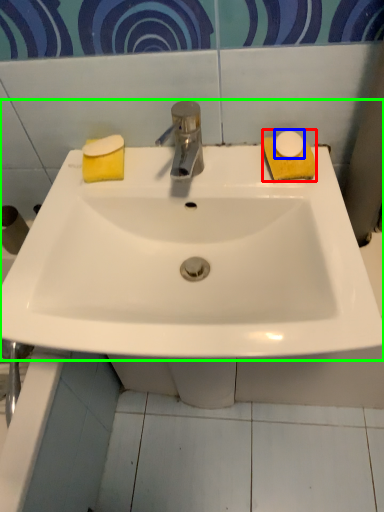
Question: Estimate the real-world distances between objects in this image. Which object is closer to soap (highlighted by a red box), soap (highlighted by a blue box) or sink (highlighted by a green box)?

Choices:
 (A) soap
 (B) sink

Answer: (A)